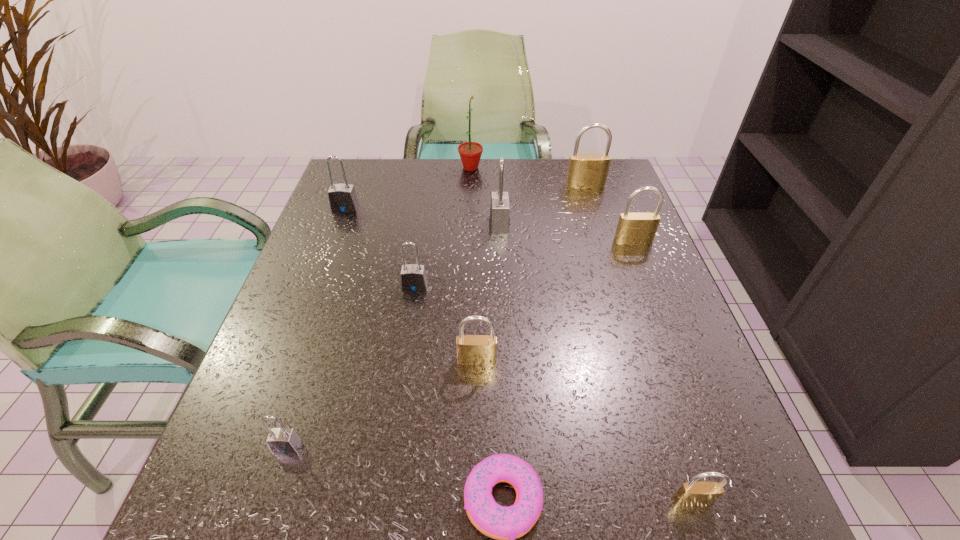
Find the location of a particular element. The image size is (960, 540). the tallest object is located at coordinates (470, 153).

I want to click on green sunflower, so click(470, 153).

The image size is (960, 540). Identify the location of the farthest padlock. (585, 171).

This screenshot has width=960, height=540. Identify the location of the ninth nearest object. (585, 171).

Where is `the rightmost gray padlock`? This screenshot has width=960, height=540. the rightmost gray padlock is located at coordinates (499, 219).

Image resolution: width=960 pixels, height=540 pixels. Identify the location of the third farthest padlock. (499, 219).

Where is `the second biggest gray padlock`? The width and height of the screenshot is (960, 540). the second biggest gray padlock is located at coordinates (342, 198).

Find the location of `the farthest gray padlock`. the farthest gray padlock is located at coordinates (342, 198).

Locate an element on the screen. the second biggest brass padlock is located at coordinates (633, 228).

Where is `the fifth farthest object`? Image resolution: width=960 pixels, height=540 pixels. the fifth farthest object is located at coordinates (633, 228).